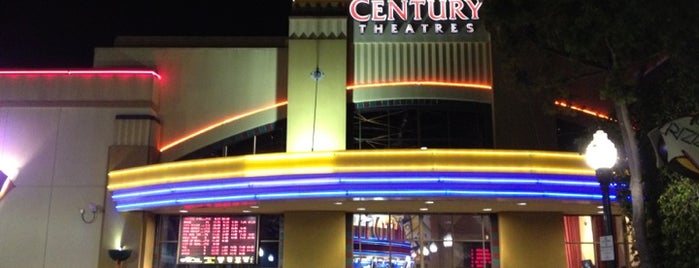
This screenshot has height=268, width=699. Find the location of `yellow neon light`. yellow neon light is located at coordinates (379, 151).